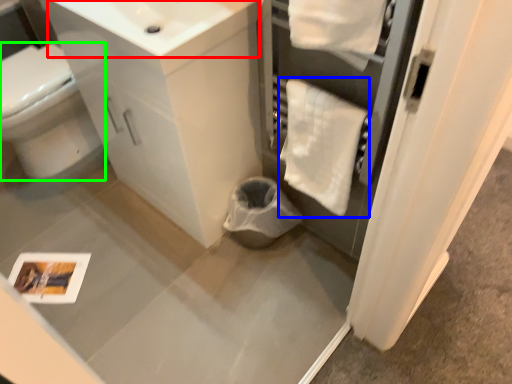
Question: Estimate the real-world distances between objects in this image. Which object is closer to sink (highlighted by a red box), bath towel (highlighted by a blue box) or bidet (highlighted by a green box)?

Choices:
 (A) bath towel
 (B) bidet

Answer: (A)